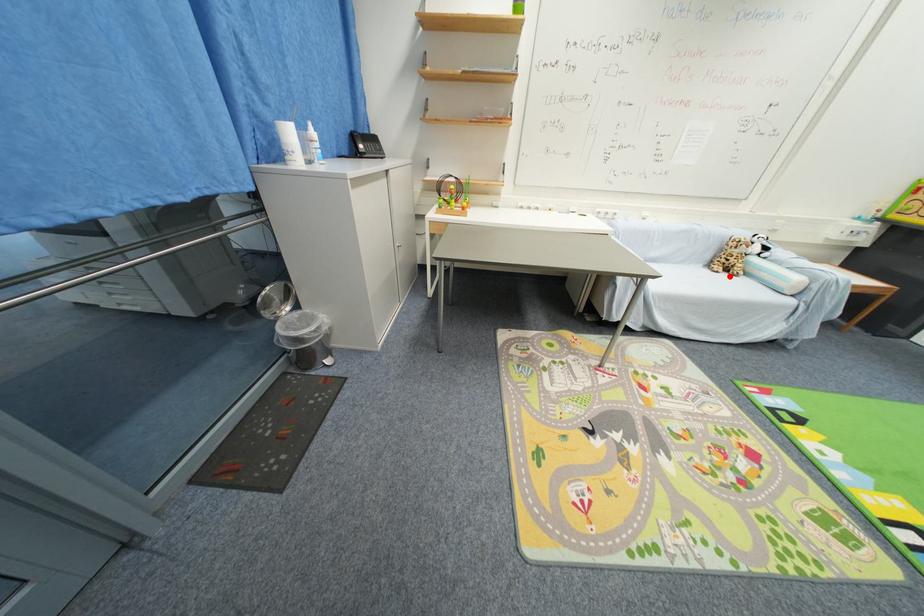
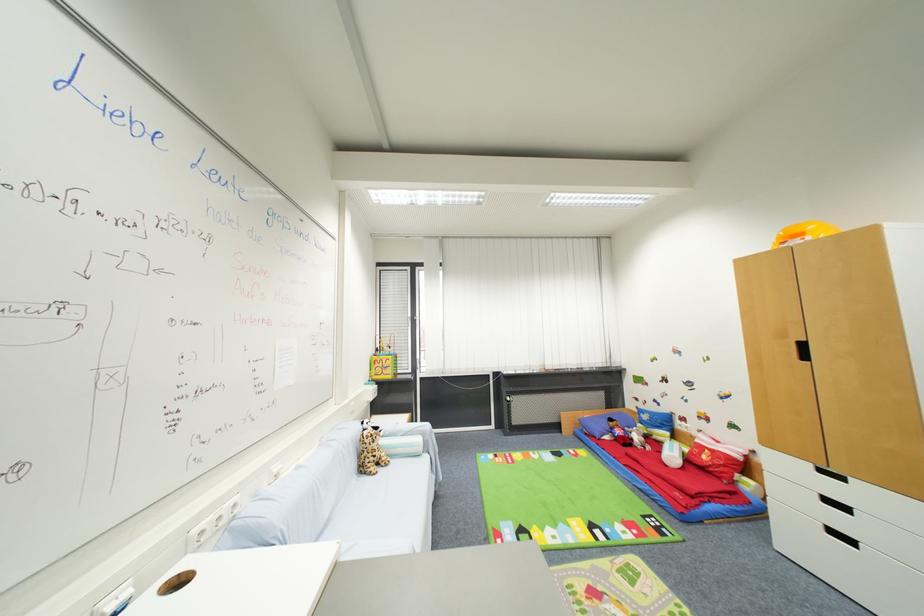
Question: A red point is marked in image1. In image2, is the corresponding 3D point closer to the camera or farther? Reply with the corresponding letter.

Choices:
 (A) The corresponding 3D point is closer.
 (B) The corresponding 3D point is farther.

Answer: (B)